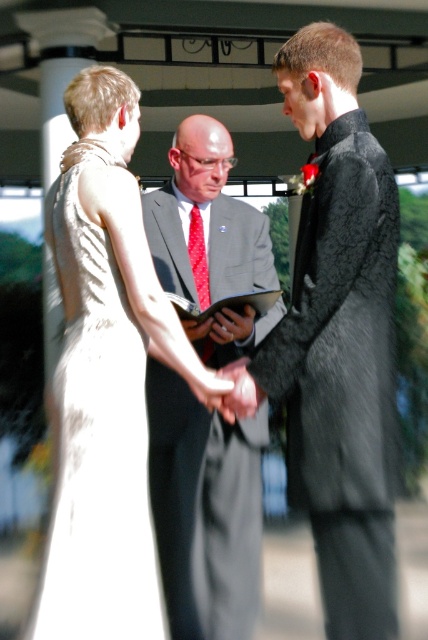
Does point (302, 394) come behind point (70, 212)?

That is False.

Which of these two, black textured suit at center or ivory satin dress at left, stands taller?

black textured suit at center

Which is in front, point (360, 195) or point (61, 388)?

Positioned in front is point (360, 195).

I want to click on black textured suit at center, so click(x=338, y=339).

Between matte gray suit at center and ivory satin dress at left, which one has more height?

matte gray suit at center is taller.

What do you see at coordinates (205, 509) in the screenshot? This screenshot has width=428, height=640. I see `matte gray suit at center` at bounding box center [205, 509].

The image size is (428, 640). What do you see at coordinates (205, 509) in the screenshot? I see `matte gray suit at center` at bounding box center [205, 509].

Find the location of a particular element. This screenshot has width=428, height=640. matte gray suit at center is located at coordinates (205, 509).

Does point (225, 401) come behind point (211, 196)?

No, it is in front of (211, 196).

Can you confirm if black textured suit at center is positioned to the left of matte gray suit at center?

In fact, black textured suit at center is to the right of matte gray suit at center.

Identify the location of black textured suit at center. The height and width of the screenshot is (640, 428). (338, 339).